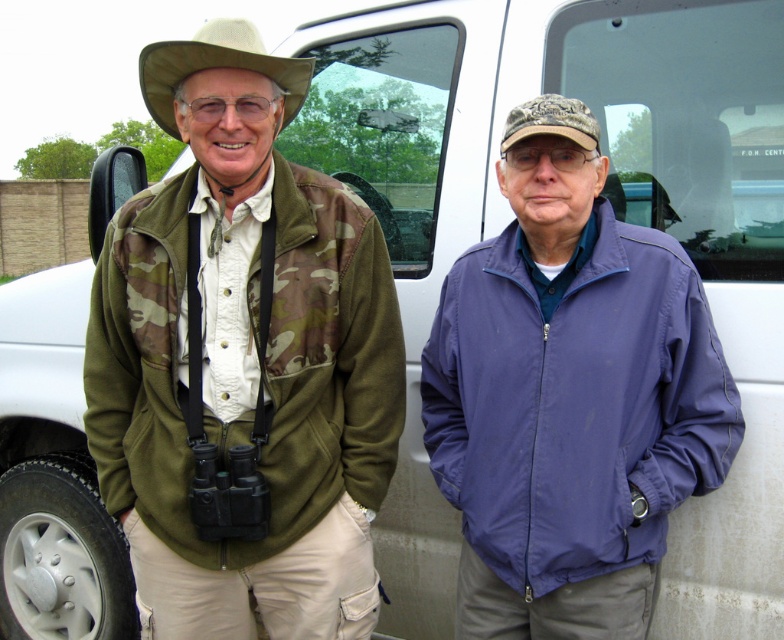
Based on the photo, you are a photographer trying to capture a group photo of the two people in the image. The photographer wants to ensure that the camo fabric jacket at left and the purple nylon jacket at center are both clearly visible in the frame. Based on their positions, which jacket is positioned closer to the left edge of the photo?

The camo fabric jacket at left is positioned to the left of the purple nylon jacket at center, so it is closer to the left edge of the photo.

You are standing at the origin of a coordinate system where the bottom left corner of the image is the origin point. You see a point at coordinate (570, 404). What object is located at that coordinate?

The point at coordinate (570, 404) indicates the purple nylon jacket at center.